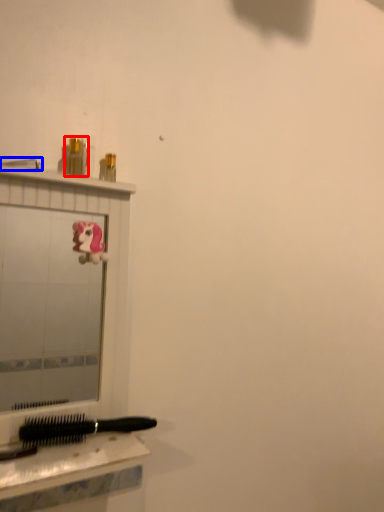
Question: Which object is closer to the camera taking this photo, toiletry (highlighted by a red box) or shower (highlighted by a blue box)?

Choices:
 (A) toiletry
 (B) shower

Answer: (B)